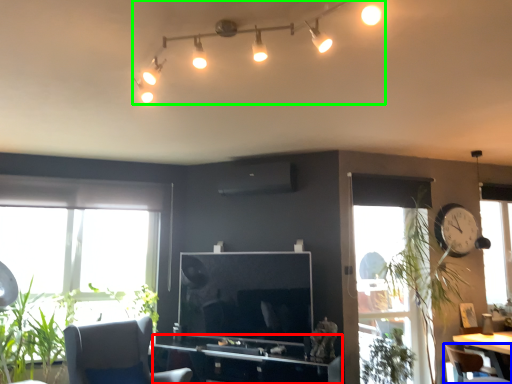
Question: Estimate the real-world distances between objects in this image. Which object is farther from computer desk (highlighted by a red box), chair (highlighted by a blue box) or light fixture (highlighted by a green box)?

Choices:
 (A) chair
 (B) light fixture

Answer: (B)